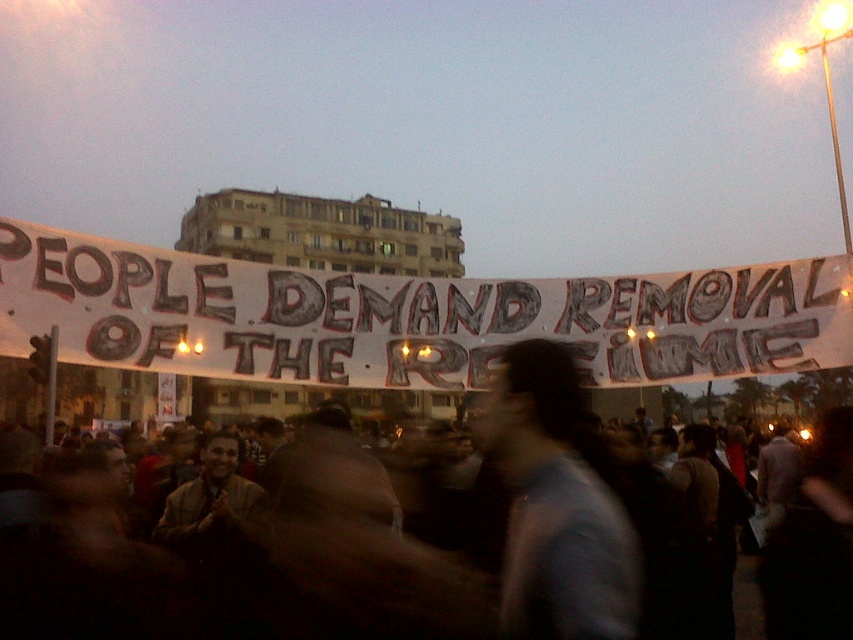
Who is taller, white paper banner at center or black fabric crowd at center?

black fabric crowd at center

Is white paper banner at center in front of black fabric crowd at center?

Yes, it is.

I want to click on white paper banner at center, so click(x=408, y=317).

Image resolution: width=853 pixels, height=640 pixels. I want to click on white paper banner at center, so click(x=408, y=317).

Is gray matte shirt at center to the right of black fabric crowd at center from the viewer's perspective?

Yes, gray matte shirt at center is to the right of black fabric crowd at center.

Is point (540, 372) closer to viewer compared to point (776, 451)?

Yes, point (540, 372) is closer to viewer.

This screenshot has height=640, width=853. In order to click on gray matte shirt at center in this screenshot , I will do `click(556, 506)`.

This screenshot has height=640, width=853. What are the coordinates of `gray matte shirt at center` in the screenshot? It's located at (556, 506).

Who is taller, white paper banner at center or gray matte shirt at center?

gray matte shirt at center

Who is more distant from viewer, [737,269] or [543,356]?

Positioned behind is point [737,269].

This screenshot has height=640, width=853. In order to click on white paper banner at center in this screenshot , I will do `click(408, 317)`.